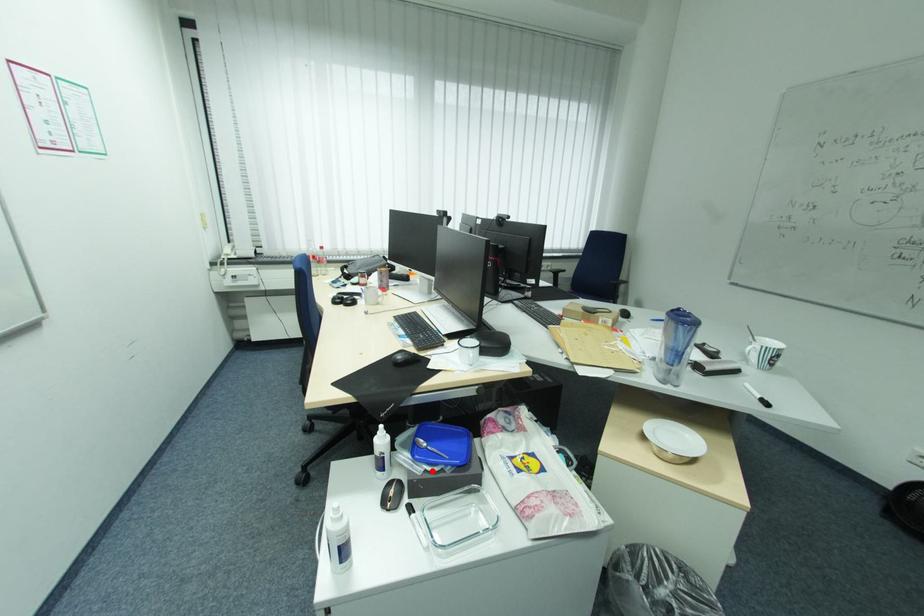
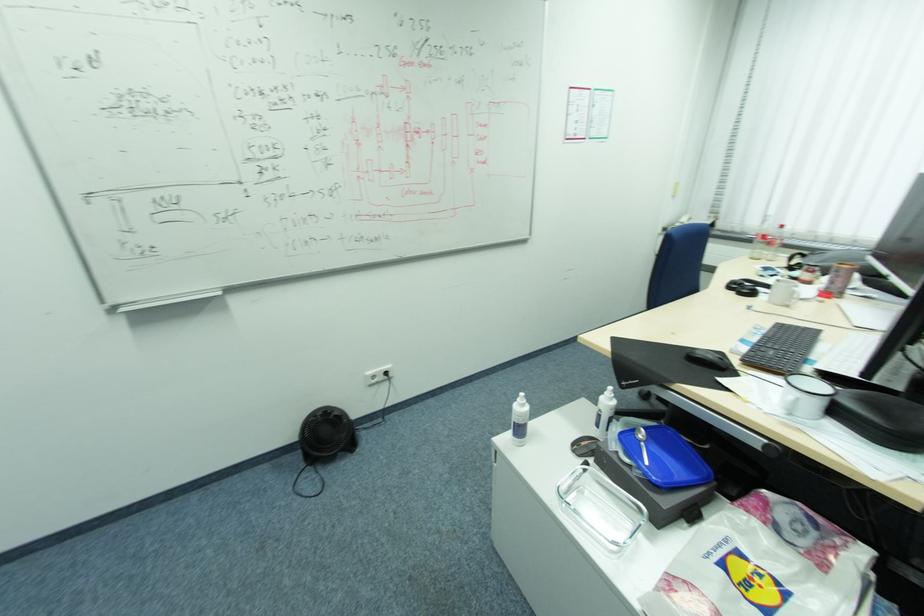
Where in the second image is the point corresponding to the highlighted location from the first image?

(624, 453)